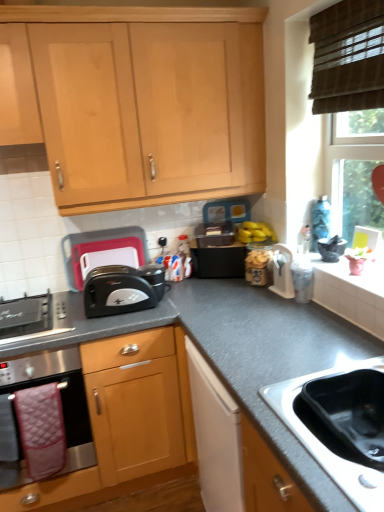
Describe the element at coordinates (234, 451) in the screenshot. The height and width of the screenshot is (512, 384). I see `black granite countertop at lower right, the 2th cabinetry positioned from the top` at that location.

What do you see at coordinates (62, 409) in the screenshot?
I see `stainless steel oven at lower left` at bounding box center [62, 409].

Describe the element at coordinates (100, 248) in the screenshot. Image resolution: width=384 pixels, height=512 pixels. I see `black plastic toaster at center-left, acting as the second appliance starting from the front` at that location.

The height and width of the screenshot is (512, 384). Identify the location of gray granite countertop at center. (268, 358).

You are a GUI agent. You are given a task and a screenshot of the screen. Output one action in this format:
    pyautogui.click(x=<x>, y=<y>)
    Task: Click on the light wood cabinet at upper center, marked as the second cabinetry in a bottom-to-top arrangement
    
    Given the screenshot: What is the action you would take?
    pyautogui.click(x=139, y=101)

Between stainless steel oven at lower left and stainless steel sink at lower right, which one appears on the left side from the viewer's perspective?

From the viewer's perspective, stainless steel oven at lower left appears more on the left side.

Consider the image. Between stainless steel oven at lower left and stainless steel sink at lower right, which one has larger width?

Wider between the two is stainless steel oven at lower left.

Is stainless steel oven at lower left far from stainless steel sink at lower right?

Yes, stainless steel oven at lower left is far from stainless steel sink at lower right.

Is stainless steel oven at lower left not within stainless steel sink at lower right?

stainless steel oven at lower left lies outside stainless steel sink at lower right's area.

In order to click on sink below the light wood cabinet at upper center, marked as the second cabinetry in a bottom-to-top arrangement (from the image's perspective) in this screenshot , I will do `click(323, 445)`.

Is stainless steel sink at lower right outside of light wood cabinet at upper center, marked as the second cabinetry in a bottom-to-top arrangement?

That's correct, stainless steel sink at lower right is outside of light wood cabinet at upper center, marked as the second cabinetry in a bottom-to-top arrangement.

Does stainless steel sink at lower right turn towards light wood cabinet at upper center, arranged as the 1th cabinetry when viewed from the top?

No, stainless steel sink at lower right does not turn towards light wood cabinet at upper center, arranged as the 1th cabinetry when viewed from the top.

From a real-world perspective, between stainless steel sink at lower right and white plastic container at upper right, the first appliance viewed from the front, who is vertically lower?

stainless steel sink at lower right.

How far apart are stainless steel sink at lower right and white plastic container at upper right, the 2th appliance positioned from the left?

They are 74.91 centimeters apart.

Considering the sizes of objects stainless steel sink at lower right and white plastic container at upper right, the second appliance in the back-to-front sequence, in the image provided, who is thinner, stainless steel sink at lower right or white plastic container at upper right, the second appliance in the back-to-front sequence,?

With smaller width is white plastic container at upper right, the second appliance in the back-to-front sequence.

Is white plastic container at upper right, the second appliance in the back-to-front sequence, a part of stainless steel sink at lower right?

No, stainless steel sink at lower right does not contain white plastic container at upper right, the second appliance in the back-to-front sequence.

Based on the photo, from the image's perspective, is black granite countertop at lower right, the 1th cabinetry positioned from the bottom, under stainless steel sink at lower right?

Yes, from the image's perspective, black granite countertop at lower right, the 1th cabinetry positioned from the bottom, is below stainless steel sink at lower right.

Can you confirm if black granite countertop at lower right, the 2th cabinetry positioned from the top, is positioned to the right of stainless steel sink at lower right?

Incorrect, black granite countertop at lower right, the 2th cabinetry positioned from the top, is not on the right side of stainless steel sink at lower right.

Locate an element on the screen. the 1st cabinetry behind when counting from the stainless steel sink at lower right is located at coordinates (234, 451).

Consider the image. Is black granite countertop at lower right, the 2th cabinetry positioned from the top, positioned with its back to stainless steel sink at lower right?

No, black granite countertop at lower right, the 2th cabinetry positioned from the top, is not facing away from stainless steel sink at lower right.

Considering the sizes of objects black plastic toaster at center and white plastic container at upper right, the first appliance viewed from the front, in the image provided, who is taller, black plastic toaster at center or white plastic container at upper right, the first appliance viewed from the front,?

white plastic container at upper right, the first appliance viewed from the front.

Is black plastic toaster at center placed right next to white plastic container at upper right, the first appliance from the right?

No, black plastic toaster at center is not touching white plastic container at upper right, the first appliance from the right.

From the image's perspective, who appears lower, black plastic toaster at center or white plastic container at upper right, the first appliance viewed from the front?

From the image's view, black plastic toaster at center is below.

Does point (162, 275) appear closer or farther from the camera than point (289, 267)?

Point (162, 275) appears to be farther away from the viewer than point (289, 267).

Is stainless steel oven at lower left thinner than black granite countertop at lower right, the 1th cabinetry positioned from the bottom?

Indeed, stainless steel oven at lower left has a lesser width compared to black granite countertop at lower right, the 1th cabinetry positioned from the bottom.

Is stainless steel oven at lower left aimed at black granite countertop at lower right, the 2th cabinetry positioned from the top?

No.

Consider the image. Would you say black granite countertop at lower right, the 2th cabinetry positioned from the top, is part of stainless steel oven at lower left's contents?

No, black granite countertop at lower right, the 2th cabinetry positioned from the top, is not a part of stainless steel oven at lower left.

Is stainless steel oven at lower left taller or shorter than black granite countertop at lower right, the 1th cabinetry positioned from the bottom?

Considering their sizes, stainless steel oven at lower left has less height than black granite countertop at lower right, the 1th cabinetry positioned from the bottom.

Is black granite countertop at lower right, the 1th cabinetry positioned from the bottom, situated inside light wood cabinet at upper center, marked as the second cabinetry in a bottom-to-top arrangement, or outside?

black granite countertop at lower right, the 1th cabinetry positioned from the bottom, is not inside light wood cabinet at upper center, marked as the second cabinetry in a bottom-to-top arrangement, it's outside.

From a real-world perspective, which object rests below the other?

In real-world perspective, black granite countertop at lower right, the 2th cabinetry positioned from the top, is lower.

From the picture: Is light wood cabinet at upper center, arranged as the 1th cabinetry when viewed from the top, at the back of black granite countertop at lower right, the 1th cabinetry positioned from the bottom?

No, black granite countertop at lower right, the 1th cabinetry positioned from the bottom, is not facing away from light wood cabinet at upper center, arranged as the 1th cabinetry when viewed from the top.

Is black granite countertop at lower right, the 1th cabinetry positioned from the bottom, bigger or smaller than light wood cabinet at upper center, arranged as the 1th cabinetry when viewed from the top?

Considering their sizes, black granite countertop at lower right, the 1th cabinetry positioned from the bottom, takes up less space than light wood cabinet at upper center, arranged as the 1th cabinetry when viewed from the top.

The width and height of the screenshot is (384, 512). I want to click on sink that is on the right side of stainless steel oven at lower left, so click(323, 445).

In the image, there is a light wood cabinet at upper center, arranged as the 1th cabinetry when viewed from the top. Identify the location of sink below it (from a real-world perspective). (323, 445).

Based on their spatial positions, is white plastic container at upper right, the second appliance in the back-to-front sequence, or black plastic toaster at center further from light wood cabinet at upper center, marked as the second cabinetry in a bottom-to-top arrangement?

white plastic container at upper right, the second appliance in the back-to-front sequence, is positioned further to the anchor light wood cabinet at upper center, marked as the second cabinetry in a bottom-to-top arrangement.

Estimate the real-world distances between objects in this image. Which object is closer to stainless steel gas stove at lower left, black plastic toaster at center-left, which appears as the 1th appliance when viewed from the back, or black granite countertop at lower right, the 2th cabinetry positioned from the top?

black plastic toaster at center-left, which appears as the 1th appliance when viewed from the back, is positioned closer to the anchor stainless steel gas stove at lower left.

From the picture: Based on their spatial positions, is stainless steel gas stove at lower left or black plastic toaster at center closer to gray granite countertop at center?

black plastic toaster at center lies closer to gray granite countertop at center than the other object.

Estimate the real-world distances between objects in this image. Which object is closer to black plastic toaster at center, black plastic toaster at center-left, which appears as the 1th appliance when viewed from the back, or stainless steel gas stove at lower left?

stainless steel gas stove at lower left.

From the image, which object appears to be farther from gray granite countertop at center, black plastic toaster at center or white plastic container at upper right, the 2th appliance positioned from the left?

white plastic container at upper right, the 2th appliance positioned from the left, lies further to gray granite countertop at center than the other object.

When comparing their distances from white plastic container at upper right, the first appliance viewed from the front, does stainless steel sink at lower right or black plastic toaster at center-left, the second appliance in the right-to-left sequence, seem closer?

Among the two, stainless steel sink at lower right is located nearer to white plastic container at upper right, the first appliance viewed from the front.

From the image, which object appears to be farther from stainless steel oven at lower left, stainless steel sink at lower right or white plastic container at upper right, the first appliance viewed from the front?

white plastic container at upper right, the first appliance viewed from the front, is positioned further to the anchor stainless steel oven at lower left.

Based on their spatial positions, is gray granite countertop at center or black plastic toaster at center-left, the second appliance in the right-to-left sequence, closer to white plastic container at upper right, the first appliance from the right?

Among the two, gray granite countertop at center is located nearer to white plastic container at upper right, the first appliance from the right.

Locate an element on the screen. This screenshot has height=512, width=384. toaster between light wood cabinet at upper center, marked as the second cabinetry in a bottom-to-top arrangement, and stainless steel oven at lower left vertically is located at coordinates (122, 289).

This screenshot has height=512, width=384. What are the coordinates of `countertop between stainless steel gas stove at lower left and white plastic container at upper right, the 2th appliance positioned from the left, in the horizontal direction` in the screenshot? It's located at (268, 358).

Find the location of a particular element. Image resolution: width=384 pixels, height=512 pixels. toaster between light wood cabinet at upper center, arranged as the 1th cabinetry when viewed from the top, and gray granite countertop at center from top to bottom is located at coordinates (122, 289).

Image resolution: width=384 pixels, height=512 pixels. Identify the location of gas stove positioned between stainless steel sink at lower right and black plastic toaster at center-left, which ranks as the 1th appliance in left-to-right order, from near to far. (28, 319).